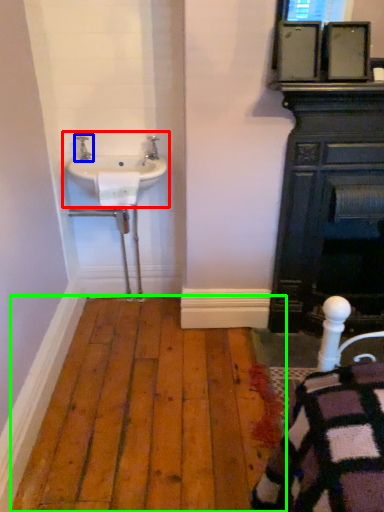
Question: Estimate the real-world distances between objects in this image. Which object is closer to sink (highlighted by a red box), tap (highlighted by a blue box) or hardwood (highlighted by a green box)?

Choices:
 (A) tap
 (B) hardwood

Answer: (A)